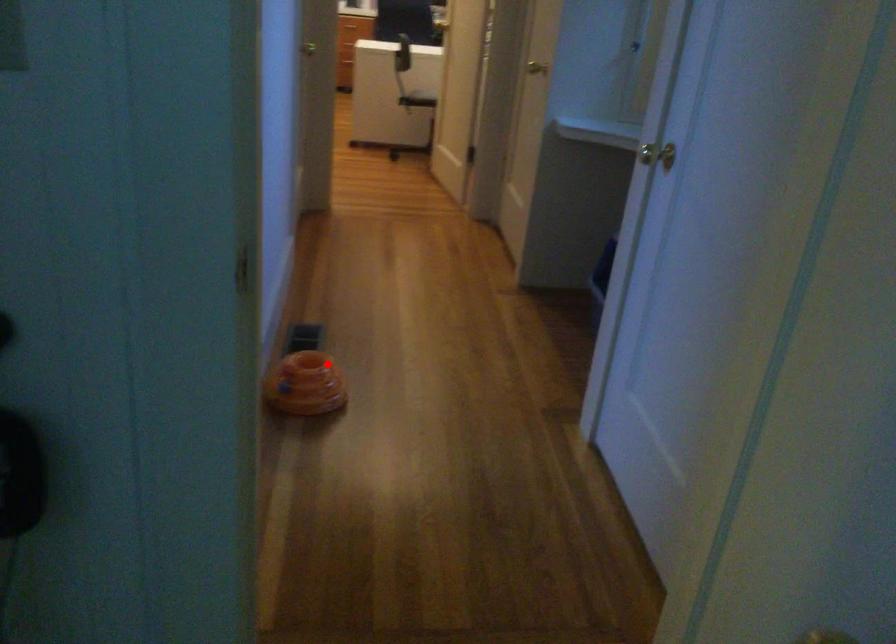
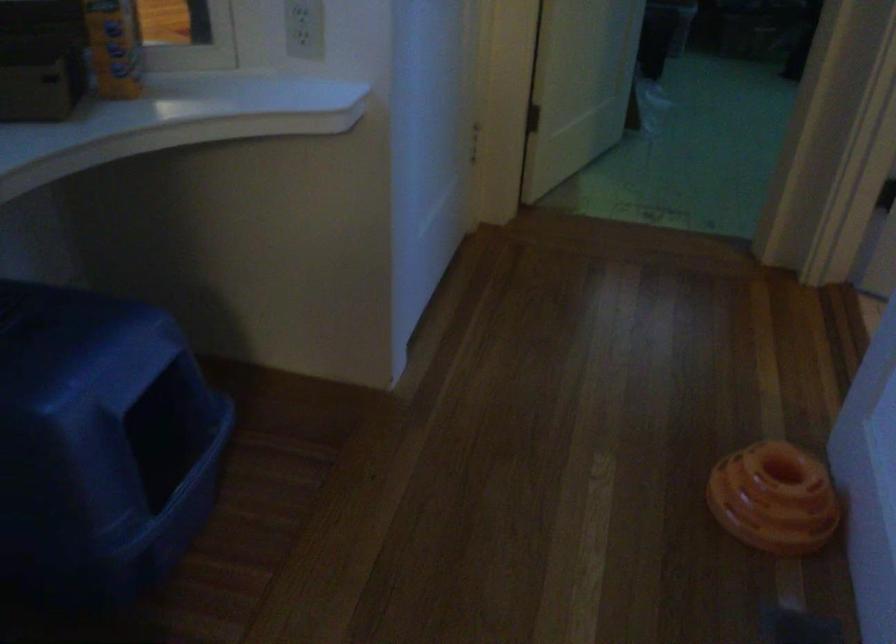
Question: I am providing you with two images of the same scene from different viewpoints. A red point is shown in image1. For the corresponding object point in image2, is it positioned nearer or farther from the camera?

Choices:
 (A) Nearer
 (B) Farther

Answer: (A)